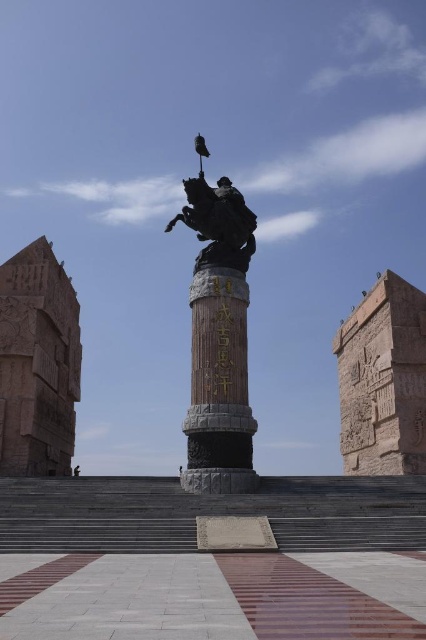
You are a visitor standing in front of the monument. You notice the black polished stone pillar at center and the polished bronze statue at center. Which object is nearer to you?

The black polished stone pillar at center is closer to the viewer than the polished bronze statue at center.

You are a tour guide explaining the monument to visitors. You want to highlight the differences between the two central features. Which of the two, the black polished stone pillar at center or the polished bronze statue at center, is narrower in width?

The black polished stone pillar at center is narrower in width compared to the polished bronze statue at center.